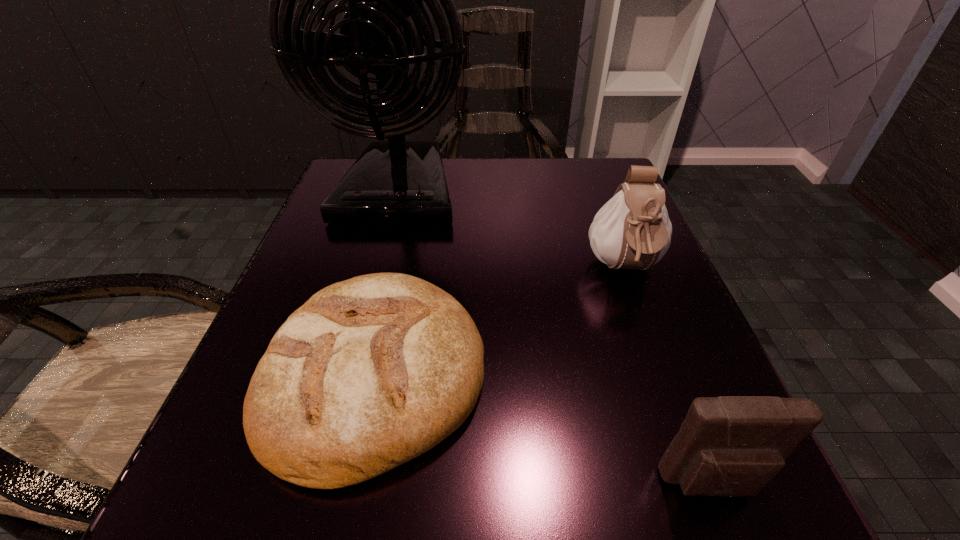
Image resolution: width=960 pixels, height=540 pixels. In the image, there is a desktop. What are the coordinates of `vacant space at the left edge` in the screenshot? It's located at 342,240.

Find the location of a particular element. The image size is (960, 540). vacant point at the right edge is located at coordinates (639, 349).

Where is `vacant region at the near left corner of the desktop`? The width and height of the screenshot is (960, 540). vacant region at the near left corner of the desktop is located at coordinates (204, 467).

In the image, there is a desktop. Where is `free region at the far right corner`? The height and width of the screenshot is (540, 960). free region at the far right corner is located at coordinates (611, 162).

You are a GUI agent. You are given a task and a screenshot of the screen. Output one action in this format:
    pyautogui.click(x=<x>, y=<y>)
    Task: Click on the empty location between the farther pouch and the bread
    
    Given the screenshot: What is the action you would take?
    pyautogui.click(x=499, y=322)

This screenshot has height=540, width=960. In order to click on free space between the fan and the third shortest object in this screenshot , I will do `click(511, 230)`.

Find the location of a particular element. free space between the taller pouch and the tallest object is located at coordinates (511, 230).

Where is `free spot between the fan and the taller pouch`? The height and width of the screenshot is (540, 960). free spot between the fan and the taller pouch is located at coordinates (511, 230).

What are the coordinates of `vacant area that lies between the shorter pouch and the shortest object` in the screenshot? It's located at (544, 429).

Locate an element on the screen. vacant space in between the taller pouch and the fan is located at coordinates (511, 230).